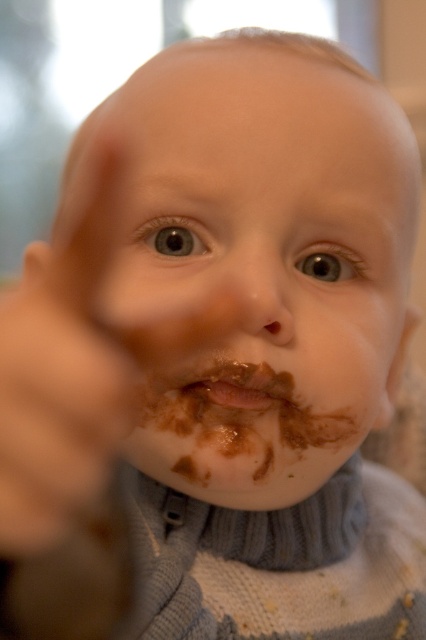
Question: Which of the following is the closest to the observer?

Choices:
 (A) brown matte finger at center
 (B) chocolate matte face at center

Answer: (A)

Question: Which object appears farthest from the camera in this image?

Choices:
 (A) brown matte finger at center
 (B) chocolate matte lips at center
 (C) chocolate matte face at center

Answer: (B)

Question: Is chocolate matte face at center above brown matte finger at center?

Choices:
 (A) yes
 (B) no

Answer: (A)

Question: Is chocolate matte face at center closer to the viewer compared to brown matte finger at center?

Choices:
 (A) yes
 (B) no

Answer: (B)

Question: Can you confirm if chocolate matte face at center is smaller than brown matte finger at center?

Choices:
 (A) no
 (B) yes

Answer: (A)

Question: Which point is closer to the camera?

Choices:
 (A) (126, 404)
 (B) (192, 384)

Answer: (A)